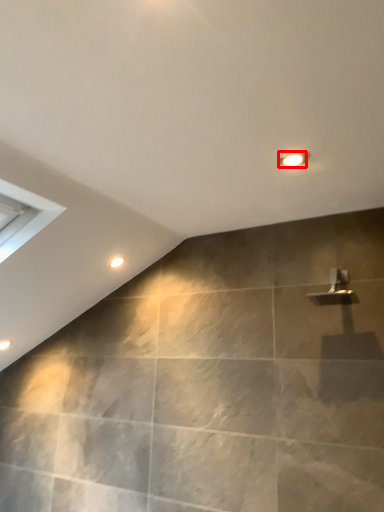
Question: Where is light fixture (annotated by the red box) located in relation to droplight in the image?

Choices:
 (A) right
 (B) left

Answer: (A)